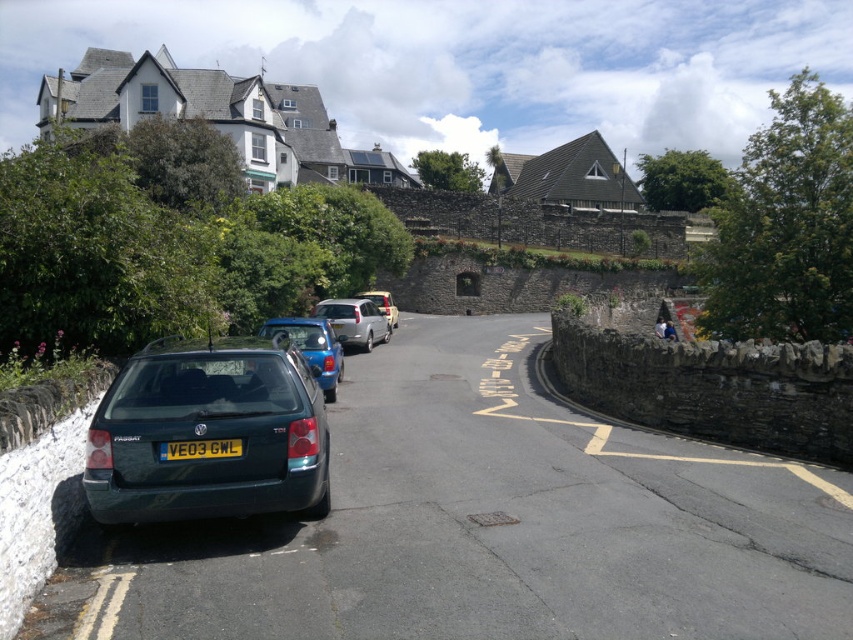
You are a delivery driver who needs to back out of a parking spot. You see the metallic green estate car at lower left and the silver metallic van at center. Which vehicle should you avoid hitting when backing up?

You should avoid hitting the metallic green estate car at lower left because it is in front of the silver metallic van at center, meaning it is closer to your vehicle when backing up.